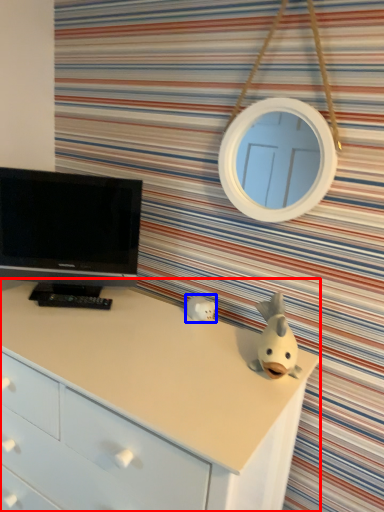
Question: Which of the following is the farthest to the observer, chest of drawers (highlighted by a red box) or toy (highlighted by a blue box)?

Choices:
 (A) chest of drawers
 (B) toy

Answer: (B)